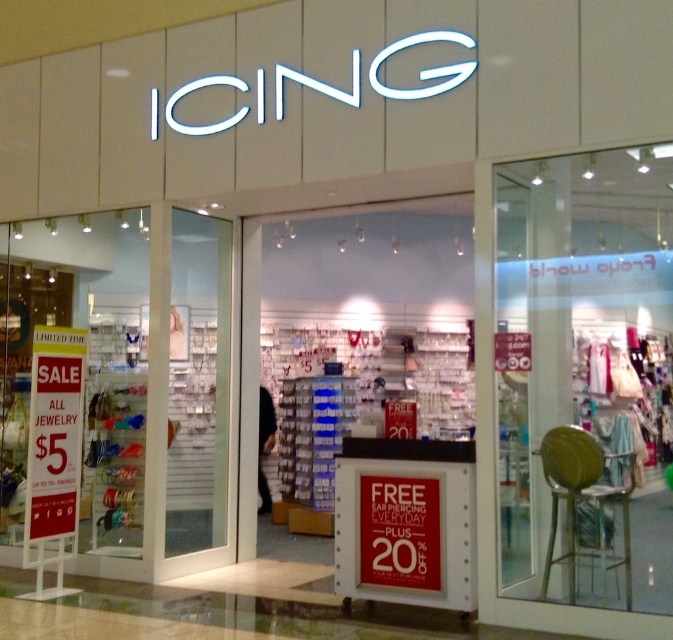
Question: Can you confirm if white paper sign at left is positioned above white paper sign at center?

Choices:
 (A) yes
 (B) no

Answer: (A)

Question: Can you confirm if transparent glass door at center is thinner than white paper sign at center?

Choices:
 (A) yes
 (B) no

Answer: (B)

Question: Among these points, which one is nearest to the camera?

Choices:
 (A) (46, 502)
 (B) (170, 532)
 (C) (618, 225)
 (D) (423, 588)

Answer: (C)

Question: Which point appears farthest from the camera in this image?

Choices:
 (A) (419, 518)
 (B) (65, 531)
 (C) (656, 257)
 (D) (182, 225)

Answer: (D)

Question: Does white paper sign at left appear on the left side of white paper sign at center?

Choices:
 (A) yes
 (B) no

Answer: (A)

Question: Estimate the real-world distances between objects in this image. Which object is closer to the white paper sign at left?

Choices:
 (A) transparent glass door at center
 (B) white paper sign at center

Answer: (A)